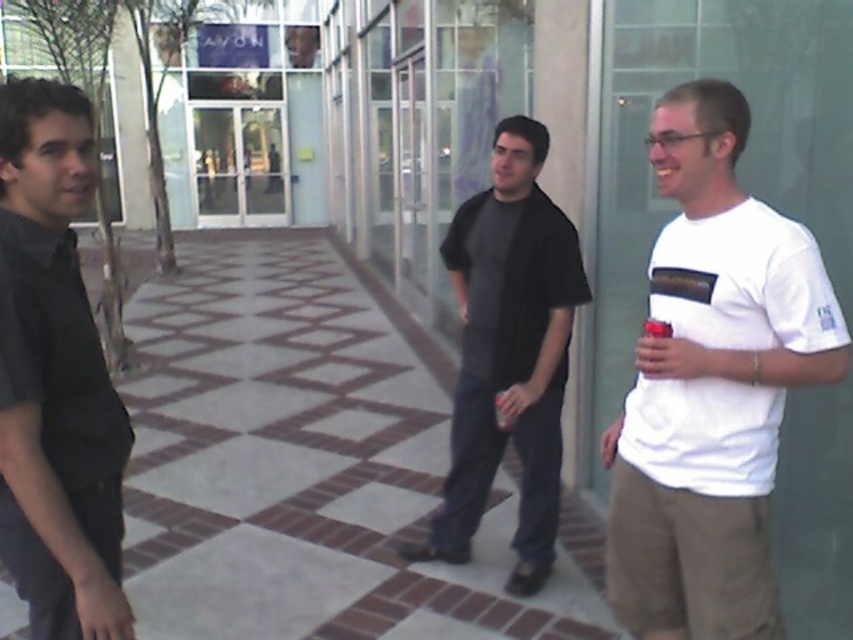
Who is shorter, checkerboard tile pavement at center or matte black shirt at left?

checkerboard tile pavement at center

Who is higher up, checkerboard tile pavement at center or matte black shirt at left?

matte black shirt at left

Image resolution: width=853 pixels, height=640 pixels. What do you see at coordinates (303, 465) in the screenshot? I see `checkerboard tile pavement at center` at bounding box center [303, 465].

What are the coordinates of `checkerboard tile pavement at center` in the screenshot? It's located at (303, 465).

Who is more forward, (x=751, y=429) or (x=10, y=218)?

Point (x=10, y=218)

Can you confirm if white matte t-shirt at right is bigger than matte black shirt at left?

Indeed, white matte t-shirt at right has a larger size compared to matte black shirt at left.

Image resolution: width=853 pixels, height=640 pixels. What do you see at coordinates (712, 385) in the screenshot?
I see `white matte t-shirt at right` at bounding box center [712, 385].

The image size is (853, 640). What are the coordinates of `white matte t-shirt at right` in the screenshot? It's located at (712, 385).

Which is behind, point (300, 314) or point (763, 572)?

Point (300, 314)

Is checkerboard tile pavement at center bigger than white matte t-shirt at right?

Yes, checkerboard tile pavement at center is bigger than white matte t-shirt at right.

Between point (287, 502) and point (662, 490), which one is positioned behind?

The point (287, 502) is behind.

The image size is (853, 640). Identify the location of checkerboard tile pavement at center. (303, 465).